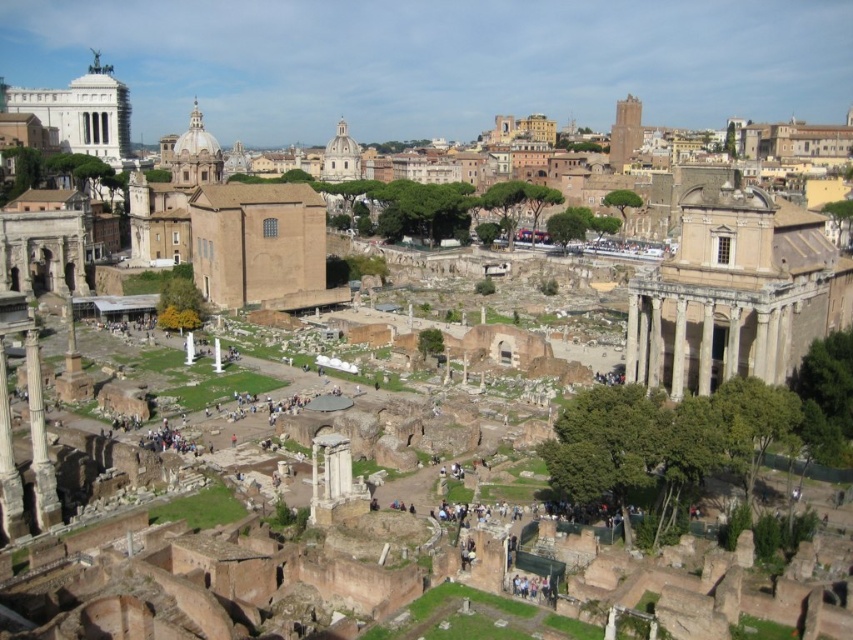
Does beige stone temple at center right appear on the left side of white marble column at left?

No, beige stone temple at center right is not to the left of white marble column at left.

Is point (712, 248) farther from camera compared to point (39, 429)?

Yes.

Locate an element on the screen. This screenshot has width=853, height=640. beige stone temple at center right is located at coordinates (735, 292).